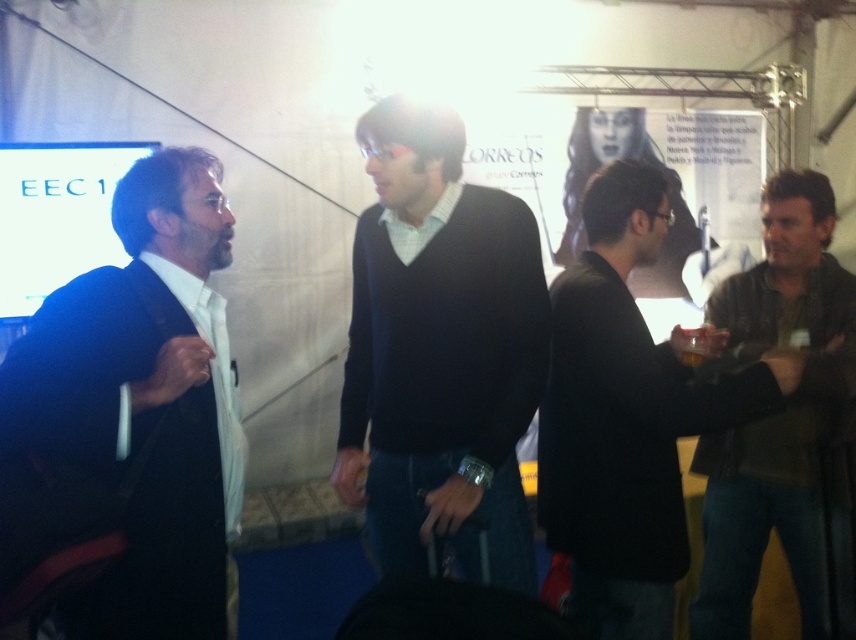
You are standing in the conference hall and see the dark blue sweater at center and the white paper poster at center. Which object is positioned higher in the scene?

The white paper poster at center is positioned higher than the dark blue sweater at center.

Where is the dark blue suit at left located in the image?

The dark blue suit at left is located at point 0.652 on the x axis and 0.155 on the y axis.